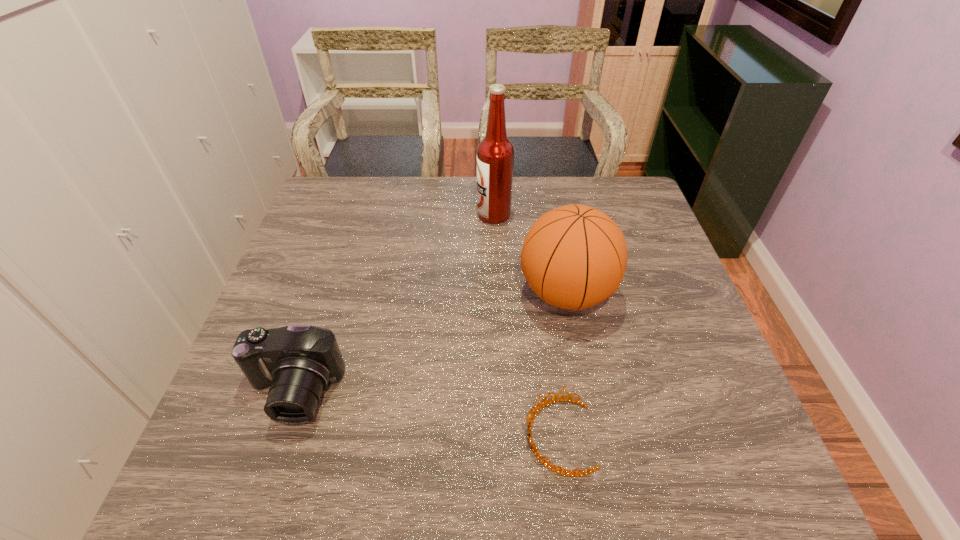
Identify the location of vacant space at the left edge. (232, 418).

Where is `vacant space at the right edge of the desktop`? This screenshot has height=540, width=960. vacant space at the right edge of the desktop is located at coordinates (643, 225).

The height and width of the screenshot is (540, 960). I want to click on free space at the far left corner of the desktop, so click(x=316, y=200).

Identify the location of blank space at the far right corner of the desktop. (647, 216).

Locate an element on the screen. The width and height of the screenshot is (960, 540). free point between the camera and the third shortest object is located at coordinates (430, 343).

This screenshot has width=960, height=540. Find the location of `empty space between the farthest object and the camera`. empty space between the farthest object and the camera is located at coordinates (394, 303).

You are a GUI agent. You are given a task and a screenshot of the screen. Output one action in this format:
    pyautogui.click(x=<x>, y=<y>)
    Task: Click on the vacant area between the camera and the third shortest object
    Image resolution: width=960 pixels, height=540 pixels.
    Given the screenshot: What is the action you would take?
    pyautogui.click(x=430, y=343)

You are a GUI agent. You are given a task and a screenshot of the screen. Output one action in this format:
    pyautogui.click(x=<x>, y=<y>)
    Task: Click on the free spot between the alcohol and the leftmost object
    This screenshot has width=960, height=540.
    Given the screenshot: What is the action you would take?
    pyautogui.click(x=394, y=303)

Locate an element on the screen. This screenshot has height=540, width=960. vacant point located between the leftmost object and the farthest object is located at coordinates (394, 303).

The image size is (960, 540). I want to click on vacant space in between the farthest object and the shortest object, so click(526, 325).